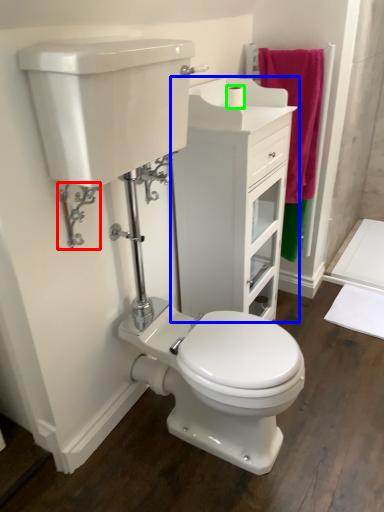
Question: Which is nearer to the plumbing fixture (highlighted by a red box)? bathroom cabinet (highlighted by a blue box) or toilet paper (highlighted by a green box).

Choices:
 (A) bathroom cabinet
 (B) toilet paper

Answer: (A)